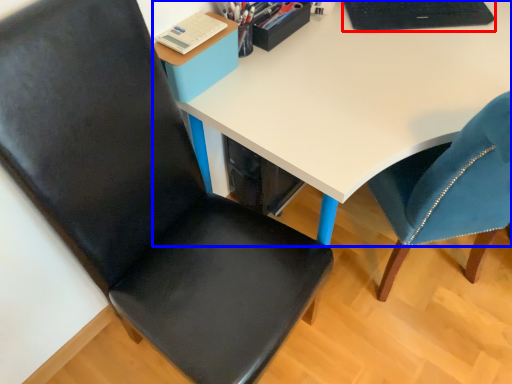
Question: Which object is closer to the camera taking this photo, laptop (highlighted by a red box) or desk (highlighted by a blue box)?

Choices:
 (A) laptop
 (B) desk

Answer: (B)